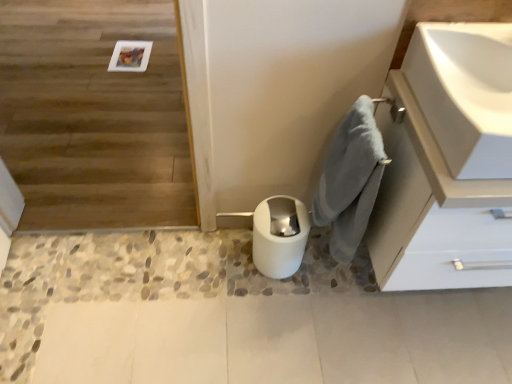
Question: Can we say wooden floor at upper left lies outside white glossy toilet bowl at lower center?

Choices:
 (A) no
 (B) yes

Answer: (B)

Question: Would you say white glossy toilet bowl at lower center is part of wooden floor at upper left's contents?

Choices:
 (A) yes
 (B) no

Answer: (B)

Question: From a real-world perspective, is wooden floor at upper left physically above white glossy toilet bowl at lower center?

Choices:
 (A) no
 (B) yes

Answer: (B)

Question: Is wooden floor at upper left shorter than white glossy toilet bowl at lower center?

Choices:
 (A) no
 (B) yes

Answer: (A)

Question: Considering the relative positions of wooden floor at upper left and white glossy toilet bowl at lower center in the image provided, is wooden floor at upper left to the left of white glossy toilet bowl at lower center from the viewer's perspective?

Choices:
 (A) no
 (B) yes

Answer: (B)

Question: From a real-world perspective, is wooden floor at upper left located beneath white glossy toilet bowl at lower center?

Choices:
 (A) no
 (B) yes

Answer: (A)

Question: Is the depth of gray fluffy bath towel at lower right less than that of white matte cabinet at upper right?

Choices:
 (A) no
 (B) yes

Answer: (A)

Question: Are gray fluffy bath towel at lower right and white matte cabinet at upper right located far from each other?

Choices:
 (A) yes
 (B) no

Answer: (B)

Question: From the image's perspective, is gray fluffy bath towel at lower right located above white matte cabinet at upper right?

Choices:
 (A) yes
 (B) no

Answer: (A)

Question: Considering the relative sizes of gray fluffy bath towel at lower right and white matte cabinet at upper right in the image provided, is gray fluffy bath towel at lower right wider than white matte cabinet at upper right?

Choices:
 (A) yes
 (B) no

Answer: (B)

Question: Does gray fluffy bath towel at lower right appear on the right side of white matte cabinet at upper right?

Choices:
 (A) no
 (B) yes

Answer: (A)

Question: Is gray fluffy bath towel at lower right at the left side of white matte cabinet at upper right?

Choices:
 (A) yes
 (B) no

Answer: (A)

Question: Would you say gray fluffy bath towel at lower right is part of wooden floor at upper left's contents?

Choices:
 (A) no
 (B) yes

Answer: (A)